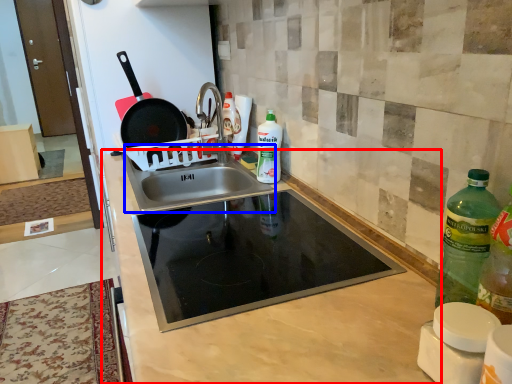
Question: Which object appears farthest to the camera in this image, countertop (highlighted by a red box) or sink (highlighted by a blue box)?

Choices:
 (A) countertop
 (B) sink

Answer: (B)